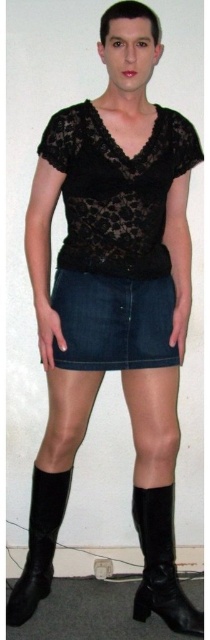
Is denim skirt at center taller than black leather boot at lower center?

No.

This screenshot has height=640, width=210. What do you see at coordinates (112, 321) in the screenshot?
I see `denim skirt at center` at bounding box center [112, 321].

I want to click on denim skirt at center, so click(112, 321).

Measure the distance between lace fabric top at center and camera.

4.77 feet

Does point (108, 218) come behind point (162, 536)?

No, it is in front of (162, 536).

Find the location of `lace fabric top at center`. lace fabric top at center is located at coordinates (116, 189).

Is lace fabric top at center below black leather boot at lower left?

Actually, lace fabric top at center is above black leather boot at lower left.

Is lace fabric top at center to the right of black leather boot at lower left from the viewer's perspective?

Indeed, lace fabric top at center is positioned on the right side of black leather boot at lower left.

Locate an element on the screen. This screenshot has height=640, width=210. lace fabric top at center is located at coordinates (116, 189).

Where is `lace fabric top at center`? This screenshot has width=210, height=640. lace fabric top at center is located at coordinates tap(116, 189).